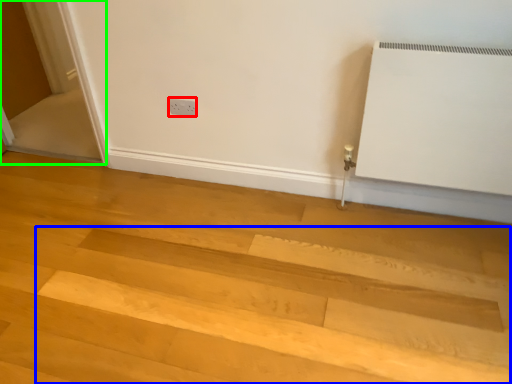
Question: Which is farther away from electric outlet (highlighted by a red box)? stairwell (highlighted by a blue box) or screen door (highlighted by a green box)?

Choices:
 (A) stairwell
 (B) screen door

Answer: (B)